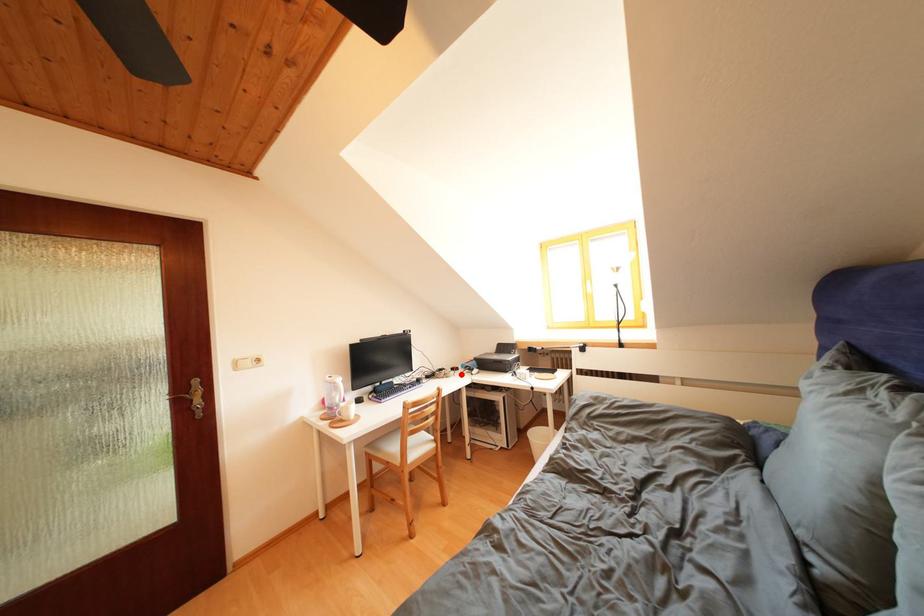
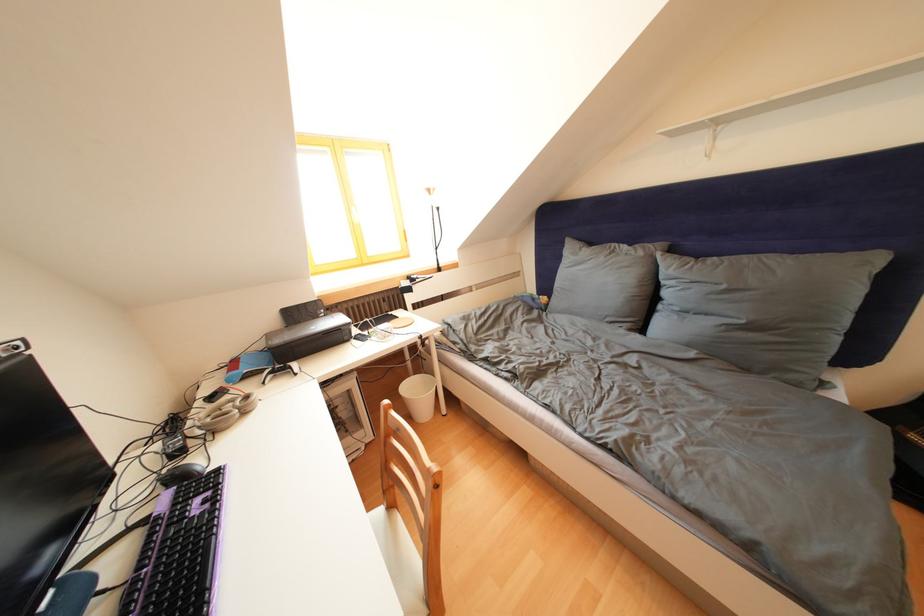
The point at the highlighted location is marked in the first image. Where is the corresponding point in the second image?

(220, 403)